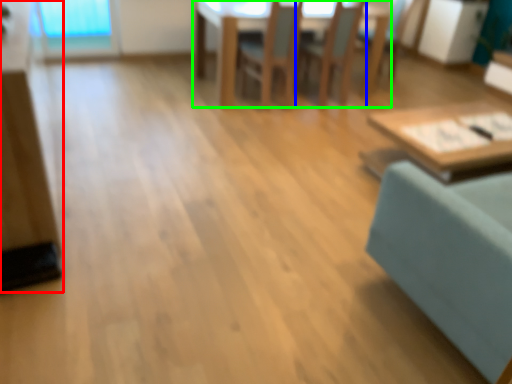
Question: Considering the real-world distances, which object is closest to dresser (highlighted by a red box)? chair (highlighted by a blue box) or table (highlighted by a green box).

Choices:
 (A) chair
 (B) table

Answer: (B)